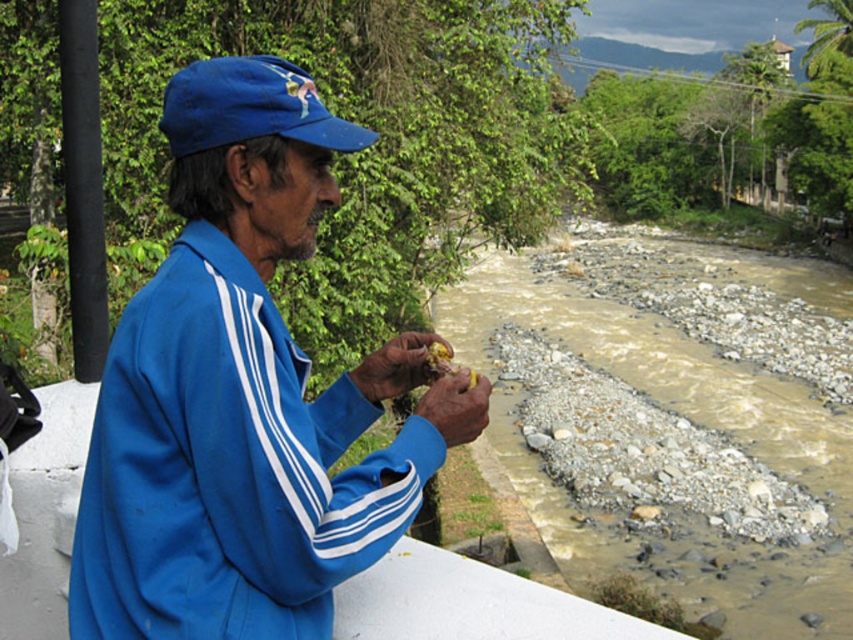
You are a botanist examining the scene. You notice the yellow matte fruit at center. Where exactly is it positioned in relation to the river and the man?

The yellow matte fruit at center is located at point (396, 365), which places it centrally in the image between the man and the river.